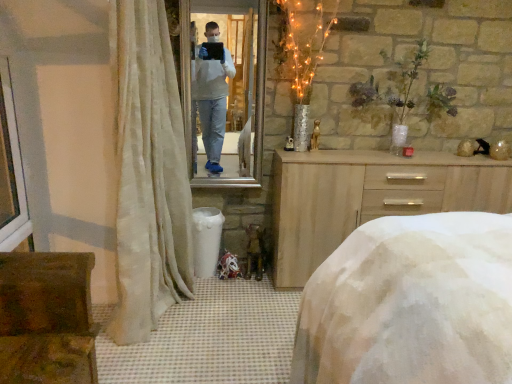
Question: Can you confirm if metallic reflective mirror at center is thinner than white plastic window frame at left?

Choices:
 (A) yes
 (B) no

Answer: (A)

Question: Can you confirm if metallic reflective mirror at center is taller than white plastic window frame at left?

Choices:
 (A) no
 (B) yes

Answer: (B)

Question: Considering the relative positions of metallic reflective mirror at center and white plastic window frame at left in the image provided, is metallic reflective mirror at center in front of white plastic window frame at left?

Choices:
 (A) no
 (B) yes

Answer: (A)

Question: Can you confirm if metallic reflective mirror at center is bigger than white plastic window frame at left?

Choices:
 (A) no
 (B) yes

Answer: (B)

Question: Is metallic reflective mirror at center touching white plastic window frame at left?

Choices:
 (A) yes
 (B) no

Answer: (B)

Question: Based on their sizes in the image, would you say rustic wooden chest at lower left is bigger or smaller than light wood dresser at center?

Choices:
 (A) big
 (B) small

Answer: (B)

Question: In terms of height, does rustic wooden chest at lower left look taller or shorter compared to light wood dresser at center?

Choices:
 (A) short
 (B) tall

Answer: (A)

Question: From a real-world perspective, is rustic wooden chest at lower left above or below light wood dresser at center?

Choices:
 (A) below
 (B) above

Answer: (A)

Question: In terms of width, does rustic wooden chest at lower left look wider or thinner when compared to light wood dresser at center?

Choices:
 (A) thin
 (B) wide

Answer: (B)

Question: From the image's perspective, is metallic reflective mirror at center located above or below rustic wooden chest at lower left?

Choices:
 (A) below
 (B) above

Answer: (B)

Question: Is metallic reflective mirror at center in front of or behind rustic wooden chest at lower left in the image?

Choices:
 (A) behind
 (B) front

Answer: (A)

Question: Looking at their shapes, would you say metallic reflective mirror at center is wider or thinner than rustic wooden chest at lower left?

Choices:
 (A) wide
 (B) thin

Answer: (B)

Question: Would you say metallic reflective mirror at center is inside or outside rustic wooden chest at lower left?

Choices:
 (A) inside
 (B) outside

Answer: (B)

Question: Is white plastic window frame at left to the left or to the right of rustic wooden chest at lower left in the image?

Choices:
 (A) right
 (B) left

Answer: (B)

Question: From a real-world perspective, is white plastic window frame at left positioned above or below rustic wooden chest at lower left?

Choices:
 (A) above
 (B) below

Answer: (A)